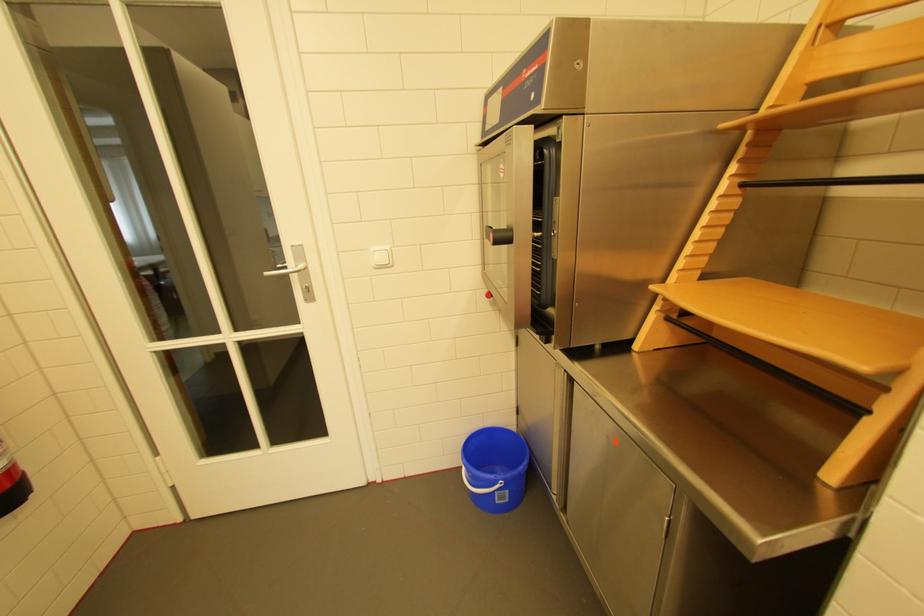
The height and width of the screenshot is (616, 924). What do you see at coordinates (479, 485) in the screenshot? I see `the white bucket handle` at bounding box center [479, 485].